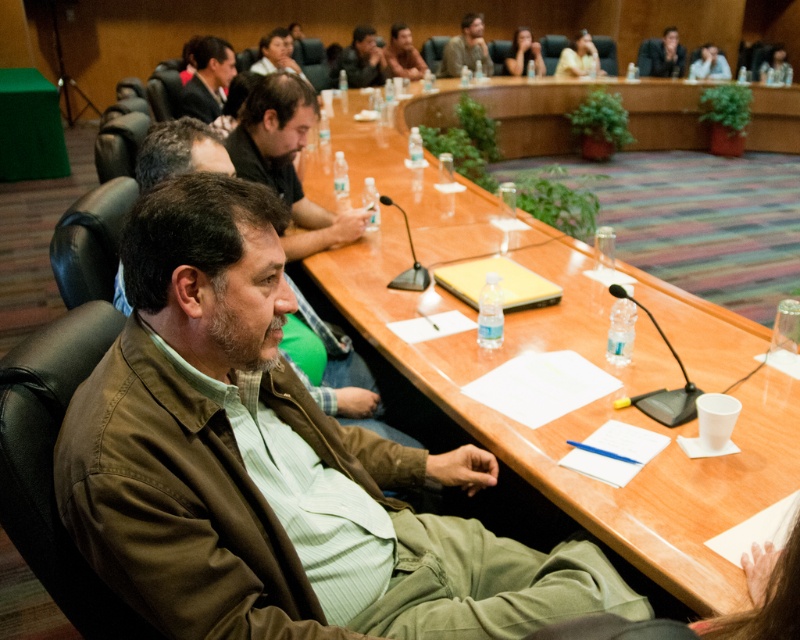
You are a photographer positioned at the back of the room. You need to capture a photo that includes both the brown leather jacket at center and the matte black laptop at upper right. Which object should you focus on first to ensure both are in frame?

The brown leather jacket at center is located below the matte black laptop at upper right, so you should focus on the matte black laptop at upper right first to ensure both are in frame by adjusting the camera angle upwards.

You are a photographer who needs to capture a closeup of the brown leather jacket at center and the matte black laptop at upper right in the scene. Since you can only focus on one object at a time, which object should you focus on first to ensure the other is still in the frame?

You should focus on the brown leather jacket at center first because it is to the left of the matte black laptop at upper right, so by focusing on the leftmost object first, the right side object will still be in the frame.

You are a photographer positioned at the back of the room. You need to capture a photo that includes both the matte black suit at upper left and the matte black laptop at upper right. Based on their positions, which object should be placed on the left side of the photo?

The matte black suit at upper left should be placed on the left side of the photo because it is positioned to the left of the matte black laptop at upper right.